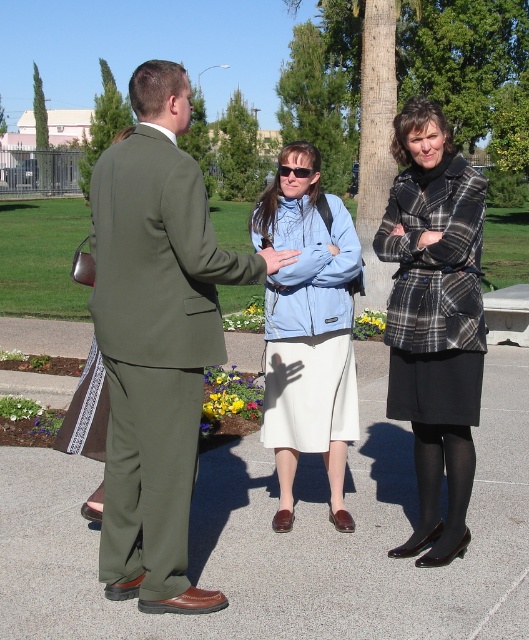
Who is more distant from viewer, (114, 448) or (290, 296)?

Point (290, 296)

Locate an element on the screen. The image size is (529, 640). olive green suit at center is located at coordinates (157, 339).

Which of these two, plaid wool coat at center or light blue fleece jacket at center, stands shorter?

With less height is light blue fleece jacket at center.

This screenshot has height=640, width=529. What do you see at coordinates (434, 320) in the screenshot?
I see `plaid wool coat at center` at bounding box center [434, 320].

Is point (443, 200) in front of point (342, 472)?

Yes, point (443, 200) is in front of point (342, 472).

I want to click on plaid wool coat at center, so click(434, 320).

Is olive green suit at center wider than plaid wool coat at center?

Correct, the width of olive green suit at center exceeds that of plaid wool coat at center.

Based on the photo, which is more to the right, olive green suit at center or plaid wool coat at center?

plaid wool coat at center is more to the right.

Locate an element on the screen. olive green suit at center is located at coordinates (157, 339).